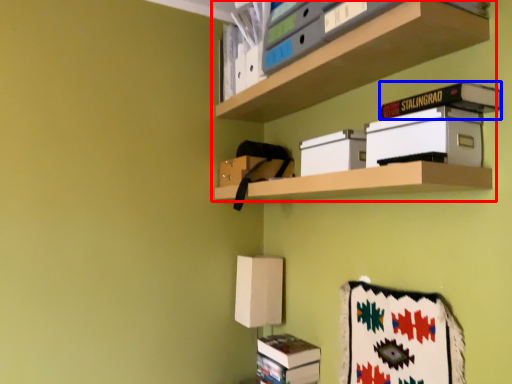
Question: Which object appears closest to the camera in this image, shelf (highlighted by a red box) or paperback book (highlighted by a blue box)?

Choices:
 (A) shelf
 (B) paperback book

Answer: (A)